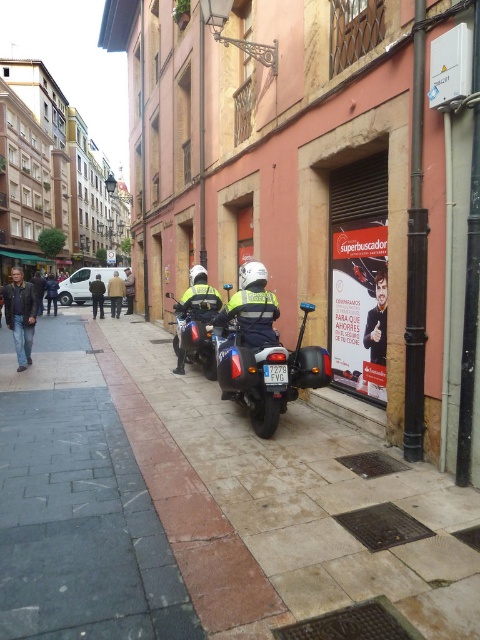
Who is shorter, metallic silver motorcycle at center or dark brown leather jacket at center?

Standing shorter between the two is metallic silver motorcycle at center.

Can you confirm if metallic silver motorcycle at center is wider than dark brown leather jacket at center?

Incorrect, metallic silver motorcycle at center's width does not surpass dark brown leather jacket at center's.

The image size is (480, 640). What do you see at coordinates (264, 360) in the screenshot?
I see `metallic silver motorcycle at center` at bounding box center [264, 360].

At what (x,y) coordinates should I click in order to perform the action: click on metallic silver motorcycle at center. Please return your answer as a coordinate pair (x, y). This screenshot has width=480, height=640. Looking at the image, I should click on (264, 360).

Describe the element at coordinates (264, 360) in the screenshot. I see `metallic silver motorcycle at center` at that location.

Which is in front, point (284, 390) or point (385, 332)?

Point (284, 390) is more forward.

Which is in front, point (237, 292) or point (384, 339)?

Positioned in front is point (384, 339).

You are a GUI agent. You are given a task and a screenshot of the screen. Output one action in this format:
    pyautogui.click(x=<x>, y=<y>)
    Task: Click on the metallic silver motorcycle at center
    Image resolution: width=480 pixels, height=640 pixels.
    Given the screenshot: What is the action you would take?
    pyautogui.click(x=264, y=360)

Is point (115, 314) farther from viewer compared to point (97, 284)?

That is False.

Who is shorter, light brown leather jacket at center or dark brown leather jacket at center?

With less height is light brown leather jacket at center.

Find the location of a particular element. light brown leather jacket at center is located at coordinates (116, 292).